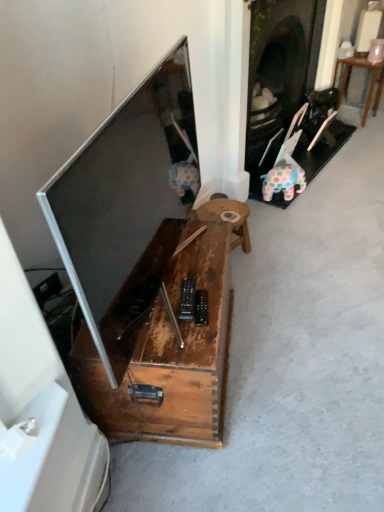
Identify the location of blank area beneath matte black tv at left (from a real-world perspective). (172, 292).